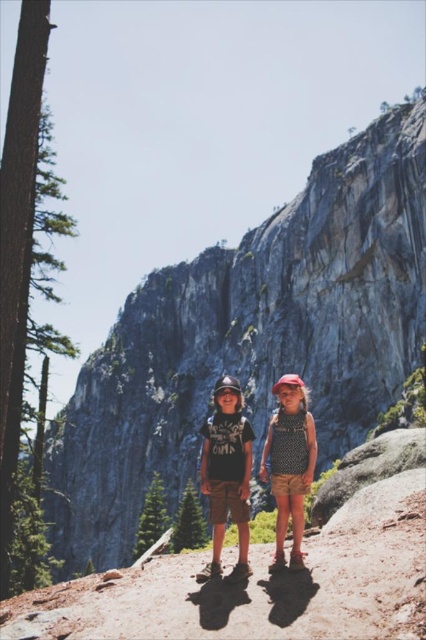
Question: Can you confirm if gray rock formation at center is positioned below matte black helmet at center?

Choices:
 (A) no
 (B) yes

Answer: (A)

Question: Does dotted fabric dress at center have a lesser width compared to green matte pine at center?

Choices:
 (A) no
 (B) yes

Answer: (B)

Question: Based on their relative distances, which object is nearer to the dotted fabric dress at center?

Choices:
 (A) matte black helmet at center
 (B) green matte pine at center

Answer: (A)

Question: Which point is farther to the camera?

Choices:
 (A) (227, 451)
 (B) (288, 420)
 (C) (140, 316)

Answer: (C)

Question: Observing the image, what is the correct spatial positioning of green matte pine at center in reference to green textured pine at center?

Choices:
 (A) left
 (B) right

Answer: (A)

Question: Among these points, which one is nearest to the camera?

Choices:
 (A) (215, 515)
 (B) (180, 545)

Answer: (A)